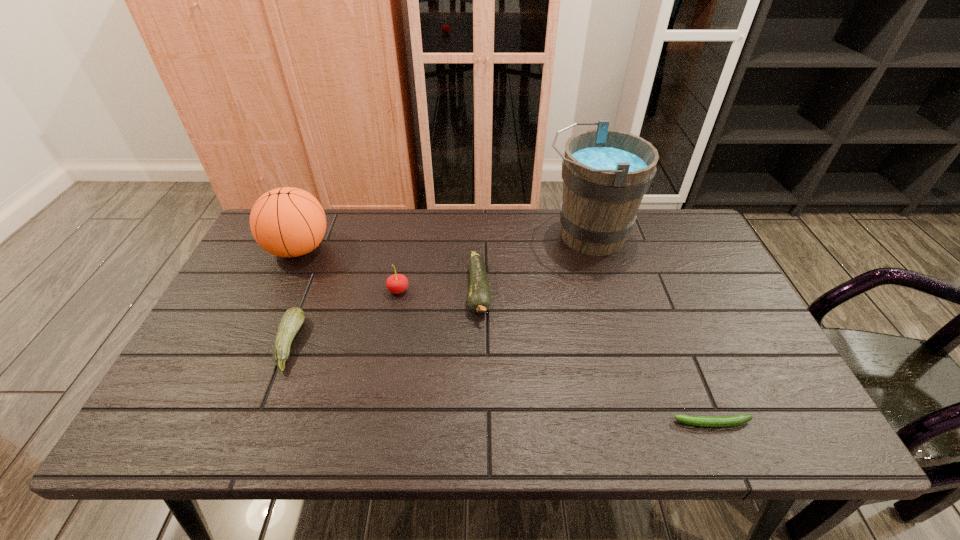
Where is `object that stands as the fourth closest to the cherry`? The width and height of the screenshot is (960, 540). object that stands as the fourth closest to the cherry is located at coordinates (605, 173).

This screenshot has height=540, width=960. In order to click on the fifth closest object to the tallest object in this screenshot , I will do `click(291, 321)`.

Where is `zucchini that is the second closest to the second shortest object`? The image size is (960, 540). zucchini that is the second closest to the second shortest object is located at coordinates (705, 421).

Identify which zucchini is located as the nearest to the second shortest zucchini. Please provide its 2D coordinates. Your answer should be formatted as a tuple, i.e. [(x, y)], where the tuple contains the x and y coordinates of a point satisfying the conditions above.

[(479, 295)]

I want to click on free space in the image that satisfies the following two spatial constraints: 1. at the blossom end of the tallest zucchini; 2. at the stem end of the second shortest zucchini, so click(479, 343).

Where is `vacant space that satisfies the following two spatial constraints: 1. at the blossom end of the third object from right to left; 2. at the stem end of the leftmost zucchini`? The height and width of the screenshot is (540, 960). vacant space that satisfies the following two spatial constraints: 1. at the blossom end of the third object from right to left; 2. at the stem end of the leftmost zucchini is located at coordinates (479, 343).